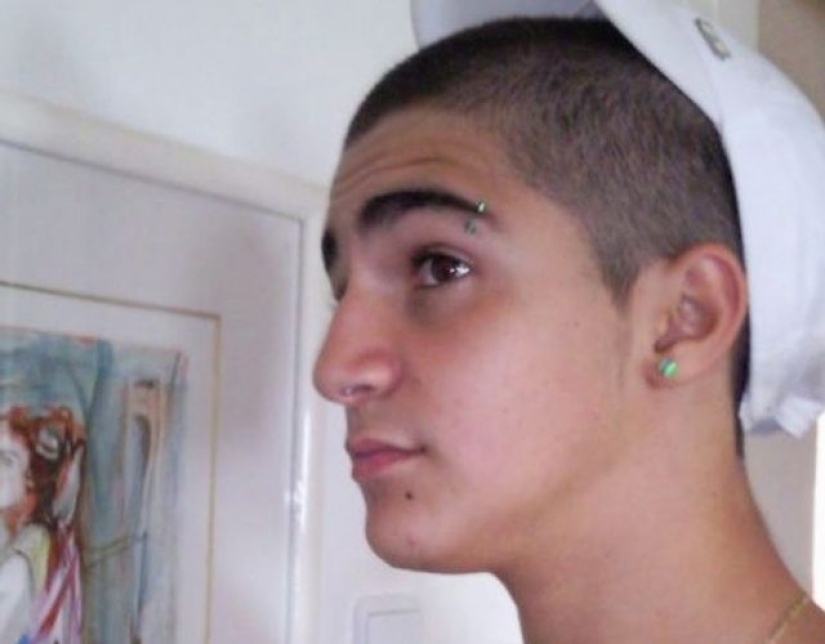
Where is `painting`? Image resolution: width=825 pixels, height=644 pixels. painting is located at coordinates (102, 525).